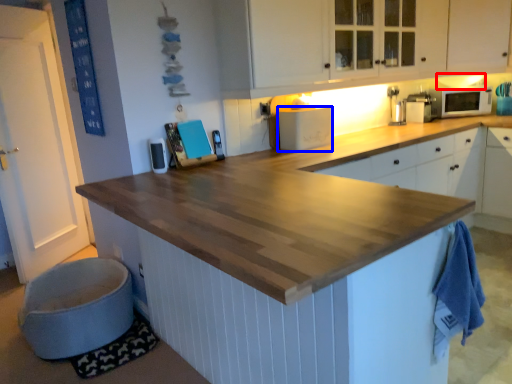
Question: Which object appears closest to the camera in this image, exhaust hood (highlighted by a red box) or appliance (highlighted by a blue box)?

Choices:
 (A) exhaust hood
 (B) appliance

Answer: (B)